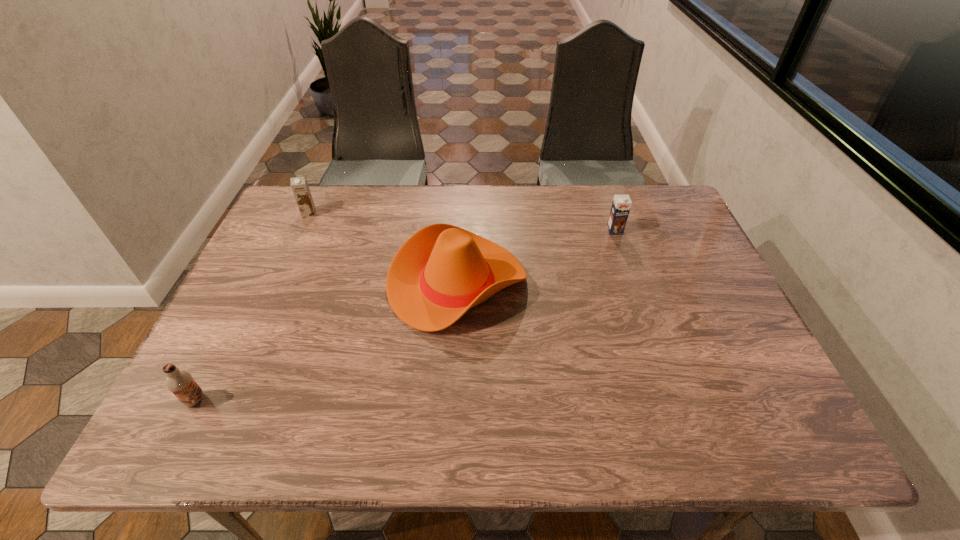
Identify the location of free space between the second farthest object and the tallest object. (536, 256).

The image size is (960, 540). Identify the location of empty location between the second nearest chocolate milk and the second object from left to right. (462, 222).

Identify which object is the third closest to the leftmost object. Please provide its 2D coordinates. Your answer should be formatted as a tuple, i.e. [(x, y)], where the tuple contains the x and y coordinates of a point satisfying the conditions above.

[(621, 205)]

The width and height of the screenshot is (960, 540). In order to click on object that stands as the third closest to the nearest object in this screenshot , I will do `click(621, 205)`.

Identify which chocolate milk is located as the nearest to the nearest chocolate milk. Please provide its 2D coordinates. Your answer should be formatted as a tuple, i.e. [(x, y)], where the tuple contains the x and y coordinates of a point satisfying the conditions above.

[(299, 185)]

Select which chocolate milk appears as the third closest to the third farthest object. Please provide its 2D coordinates. Your answer should be formatted as a tuple, i.e. [(x, y)], where the tuple contains the x and y coordinates of a point satisfying the conditions above.

[(180, 382)]

Where is `free space in the image that satisfies the following two spatial constraints: 1. on the back side of the second object from right to left; 2. on the right side of the leftmost object`? free space in the image that satisfies the following two spatial constraints: 1. on the back side of the second object from right to left; 2. on the right side of the leftmost object is located at coordinates (254, 283).